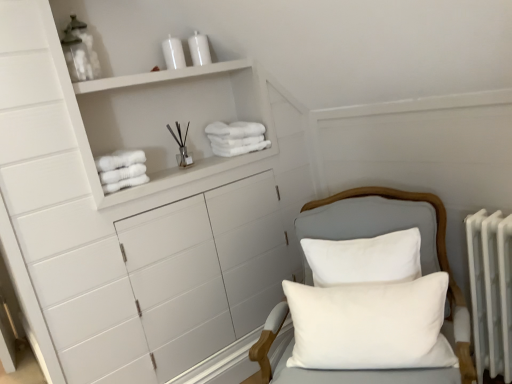
Question: Are white soft towel at upper center, placed as the 2th bath towel when sorted from front to back, and white matte cabinet at upper left beside each other?

Choices:
 (A) yes
 (B) no

Answer: (B)

Question: From a real-world perspective, is white soft towel at upper center, the 1th bath towel viewed from the top, physically above white matte cabinet at upper left?

Choices:
 (A) yes
 (B) no

Answer: (B)

Question: Is white soft towel at upper center, marked as the 2th bath towel in a bottom-to-top arrangement, positioned beyond the bounds of white matte cabinet at upper left?

Choices:
 (A) yes
 (B) no

Answer: (B)

Question: Can you confirm if white soft towel at upper center, marked as the 2th bath towel in a bottom-to-top arrangement, is positioned to the left of white matte cabinet at upper left?

Choices:
 (A) no
 (B) yes

Answer: (A)

Question: Is white soft towel at upper center, the 1th bath towel viewed from the top, positioned with its back to white matte cabinet at upper left?

Choices:
 (A) no
 (B) yes

Answer: (B)

Question: Is white fabric chair at center to the left or to the right of white soft pillow at center, which ranks as the first pillow in bottom-to-top order, in the image?

Choices:
 (A) right
 (B) left

Answer: (A)

Question: Is white fabric chair at center wider or thinner than white soft pillow at center, which ranks as the first pillow in bottom-to-top order?

Choices:
 (A) thin
 (B) wide

Answer: (B)

Question: Is white fabric chair at center in front of or behind white soft pillow at center, which ranks as the first pillow in bottom-to-top order, in the image?

Choices:
 (A) front
 (B) behind

Answer: (A)

Question: From the image's perspective, is white fabric chair at center positioned above or below white soft pillow at center, which ranks as the first pillow in bottom-to-top order?

Choices:
 (A) below
 (B) above

Answer: (A)

Question: Is white matte cabinet at upper left to the left or to the right of white soft towel at upper center, marked as the 2th bath towel in a bottom-to-top arrangement, in the image?

Choices:
 (A) left
 (B) right

Answer: (A)

Question: Is white matte cabinet at upper left in front of or behind white soft towel at upper center, the first bath towel from the back, in the image?

Choices:
 (A) front
 (B) behind

Answer: (A)

Question: From the image's perspective, is white matte cabinet at upper left located above or below white soft towel at upper center, marked as the 2th bath towel in a bottom-to-top arrangement?

Choices:
 (A) below
 (B) above

Answer: (B)

Question: Is white matte cabinet at upper left taller or shorter than white soft towel at upper center, arranged as the 1th bath towel when viewed from the right?

Choices:
 (A) short
 (B) tall

Answer: (B)

Question: From a real-world perspective, is white soft towel at upper center, the 2th bath towel from the left, above or below white fluffy towels at upper left, which appears as the 2th bath towel when viewed from the top?

Choices:
 (A) below
 (B) above

Answer: (B)

Question: Visually, is white soft towel at upper center, arranged as the 1th bath towel when viewed from the right, positioned to the left or to the right of white fluffy towels at upper left, which is the first bath towel in front-to-back order?

Choices:
 (A) left
 (B) right

Answer: (B)